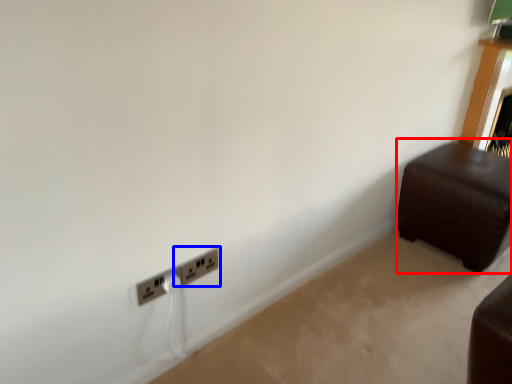
Question: Among these objects, which one is nearest to the camera, furniture (highlighted by a red box) or power plugs and sockets (highlighted by a blue box)?

Choices:
 (A) furniture
 (B) power plugs and sockets

Answer: (B)